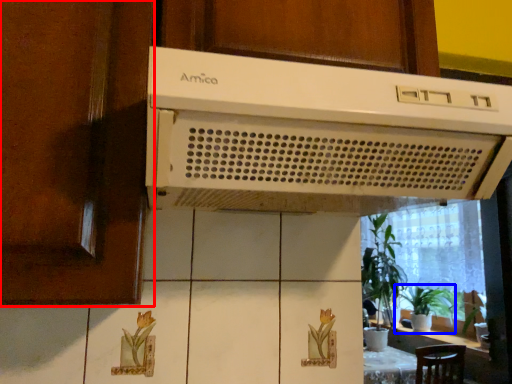
Question: Which object is further to the camera taking this photo, screen door (highlighted by a red box) or houseplant (highlighted by a blue box)?

Choices:
 (A) screen door
 (B) houseplant

Answer: (B)